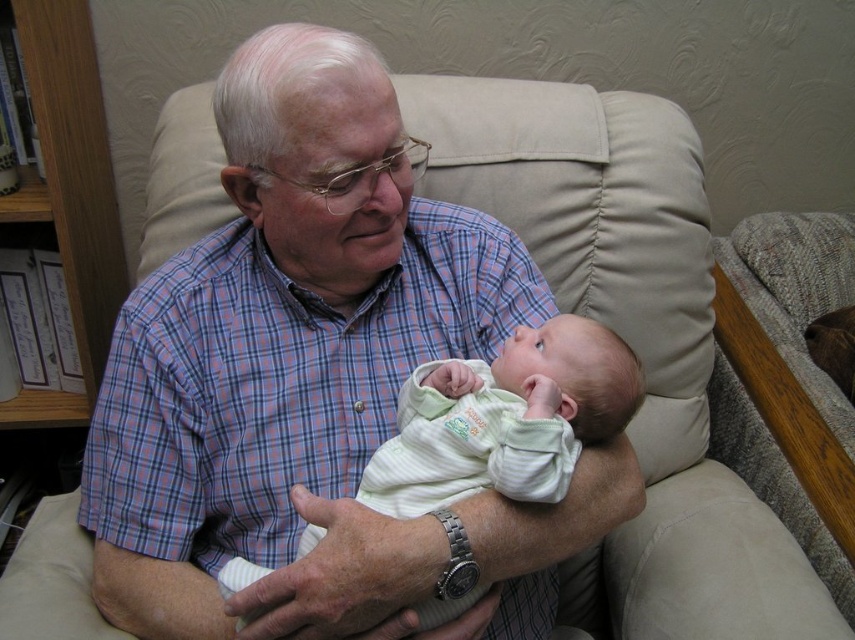
You are a photographer positioned in front of the scene. You want to take a clear photo of the light green striped fabric baby at center and the wooden bookshelf at left. Which object will appear larger in the photo?

The light green striped fabric baby at center will appear larger in the photo because it is closer to the viewer than the wooden bookshelf at left.

You are a photographer trying to capture the man and baby in the scene. You want to focus on the plaid shirt at center. Where is the point at coordinates [313,380] located?

The point at coordinates [313,380] is located on the plaid shirt at center.

You are an interior designer assessing the layout of this room. The plaid shirt at center and wooden bookshelf at left are two key elements in the space. Based on their positions, which object is closer to the floor?

The plaid shirt at center is below wooden bookshelf at left, so the plaid shirt at center is closer to the floor.